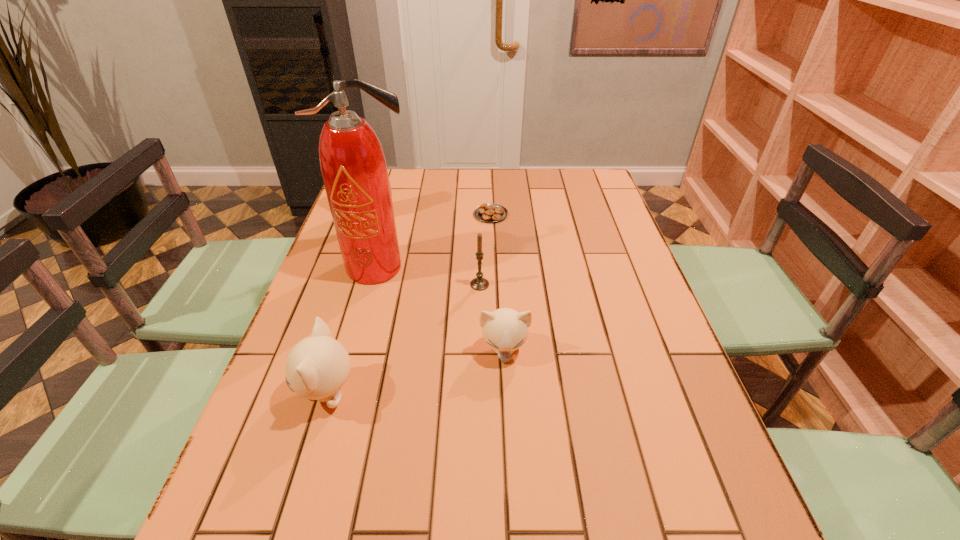
Please point a spot on the right to add another kitten. Please provide its 2D coordinates. Your answer should be formatted as a tuple, i.e. [(x, y)], where the tuple contains the x and y coordinates of a point satisfying the conditions above.

[(653, 315)]